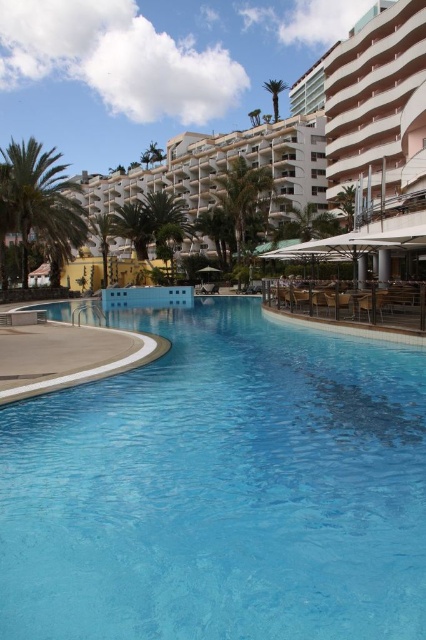
You are planning to install a new lighting system around the transparent glass pool at center and the green leafy palm tree at upper center. The lighting system requires a minimum of 1.2 meters of space between the fixtures and any objects. Given the spatial relationship between the two objects, will the lighting system be feasible to install without violating this safety distance?

The transparent glass pool at center is narrower than the green leafy palm tree at upper center. Since the pool is narrower, the required 1.2 meters of space can be maintained around both objects by positioning the fixtures appropriately, ensuring compliance with safety standards.

You are standing at the edge of the swimming pool and want to take a photo that includes both the green leafy palm tree at left and the green leafy palm tree at upper right. Which palm tree will appear larger in the photo?

The green leafy palm tree at left will appear larger in the photo because it is closer to the viewer than the green leafy palm tree at upper right.